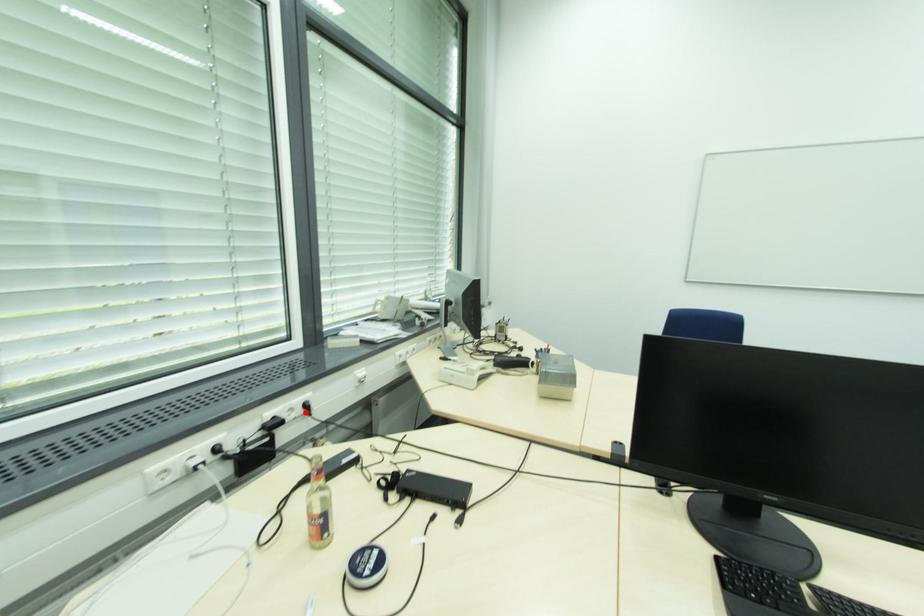
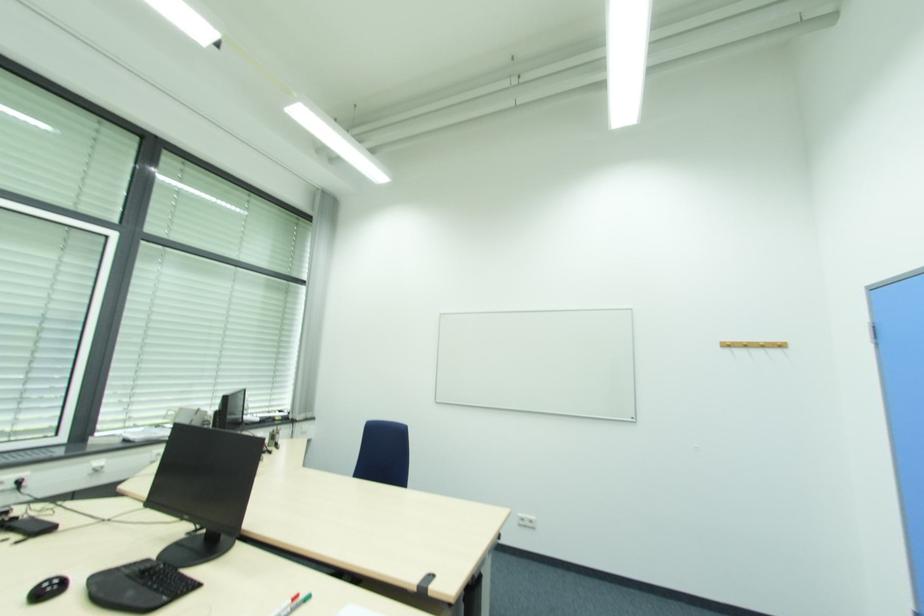
Question: I am providing you with two images of the same scene from different viewpoints. Given a red point in image1, look at the same physical point in image2. Is it:

Choices:
 (A) Closer to the viewpoint
 (B) Farther from the viewpoint

Answer: (A)